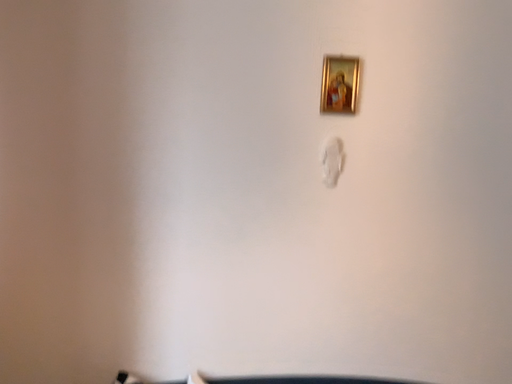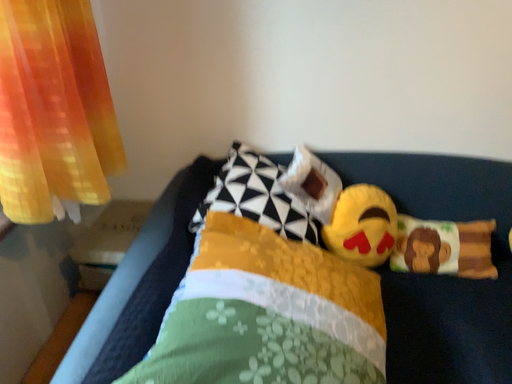
Question: Which way did the camera rotate in the video?

Choices:
 (A) rotated left
 (B) rotated right

Answer: (A)